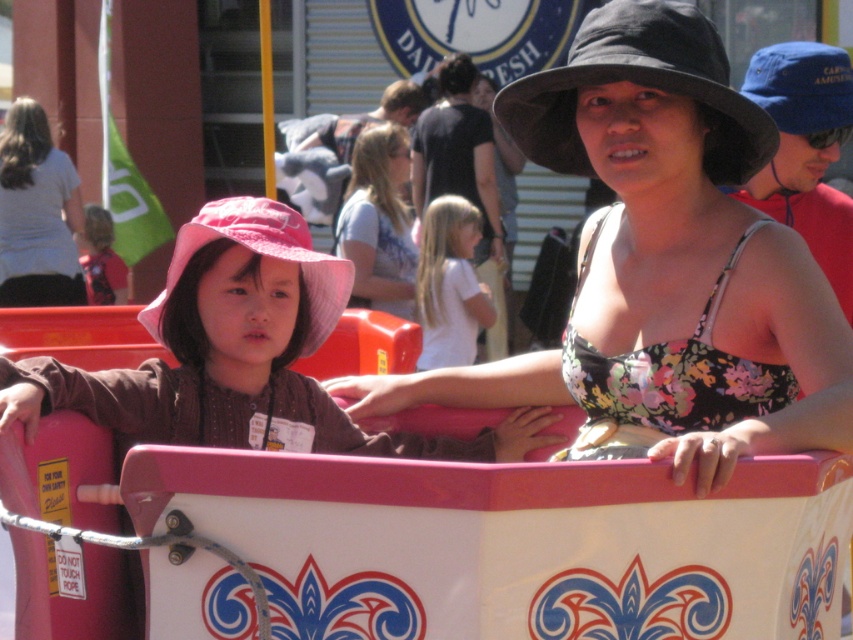
Which is in front, point (404, 132) or point (763, 77)?

Positioned in front is point (763, 77).

Between light blue denim shirt at center and blue fabric hat at upper right, which one appears on the right side from the viewer's perspective?

blue fabric hat at upper right is more to the right.

Locate an element on the screen. The width and height of the screenshot is (853, 640). light blue denim shirt at center is located at coordinates (378, 221).

Can you confirm if black fabric hat at upper center is smaller than pink fabric hat at left?

Incorrect, black fabric hat at upper center is not smaller in size than pink fabric hat at left.

Is black fabric hat at upper center shorter than pink fabric hat at left?

No.

Does point (611, 76) come in front of point (315, 330)?

That is True.

The width and height of the screenshot is (853, 640). In order to click on black fabric hat at upper center in this screenshot , I will do `click(642, 84)`.

Between floral fabric tank top at center and pink fabric hat at left, which one appears on the left side from the viewer's perspective?

Positioned to the left is pink fabric hat at left.

Is floral fabric tank top at center to the right of pink fabric hat at left from the viewer's perspective?

Yes, floral fabric tank top at center is to the right of pink fabric hat at left.

Describe the element at coordinates (663, 264) in the screenshot. The width and height of the screenshot is (853, 640). I see `floral fabric tank top at center` at that location.

You are a GUI agent. You are given a task and a screenshot of the screen. Output one action in this format:
    pyautogui.click(x=<x>, y=<y>)
    Task: Click on the floral fabric tank top at center
    The height and width of the screenshot is (640, 853).
    Given the screenshot: What is the action you would take?
    pyautogui.click(x=663, y=264)